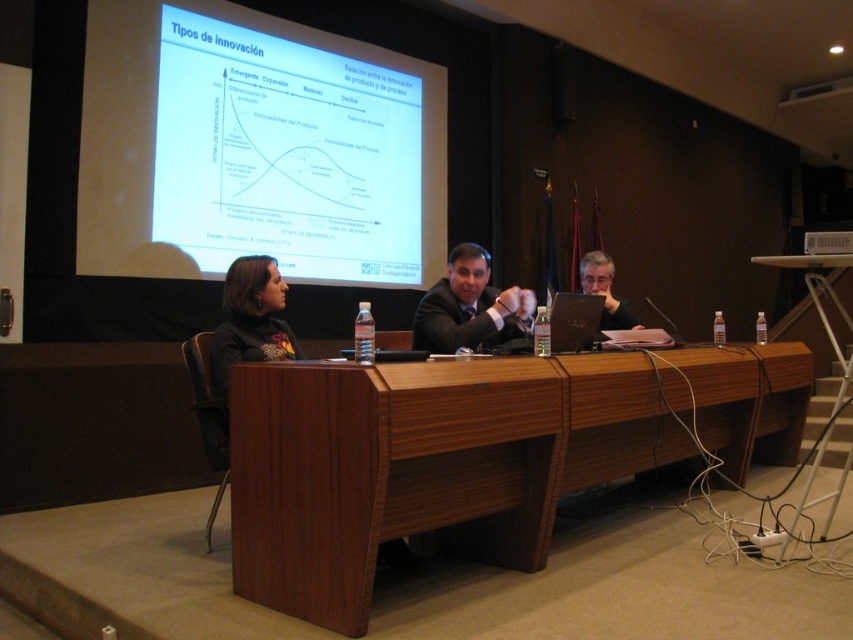
You are organizing a photoshoot and need to place a 28 inch wide decorative panel between the dark suit at center and the dark brown leather jacket at left. Will there be enough space for it?

The dark suit at center is 30.97 inches from the dark brown leather jacket at left. Since the decorative panel is 28 inches wide, there is enough space to place it between them.

In the presentation setting, there are two key items of clothing worn by the participants. The dark suit at center and the dark brown leather jacket at left. Which of these two items is shorter in height?

The dark suit at center has a lesser height compared to the dark brown leather jacket at left, so the dark suit at center is shorter in height.

You are an attendee sitting at the back of the room and want to approach the table to ask a question. Which object, the dark suit at center or the dark brown leather jacket at left, will you reach first as you walk towards the table?

You will reach the dark suit at center first because it is closer to you than the dark brown leather jacket at left, which is further away.